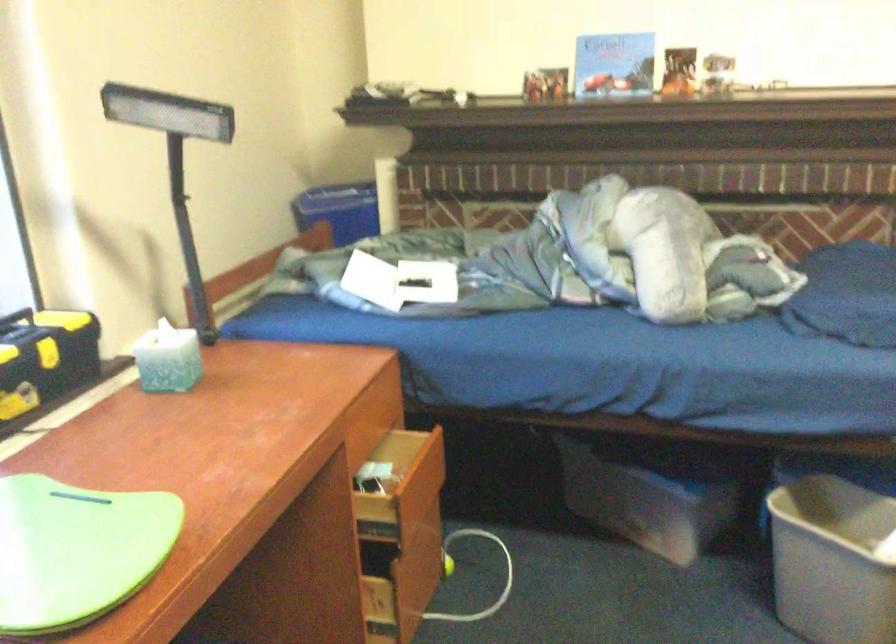
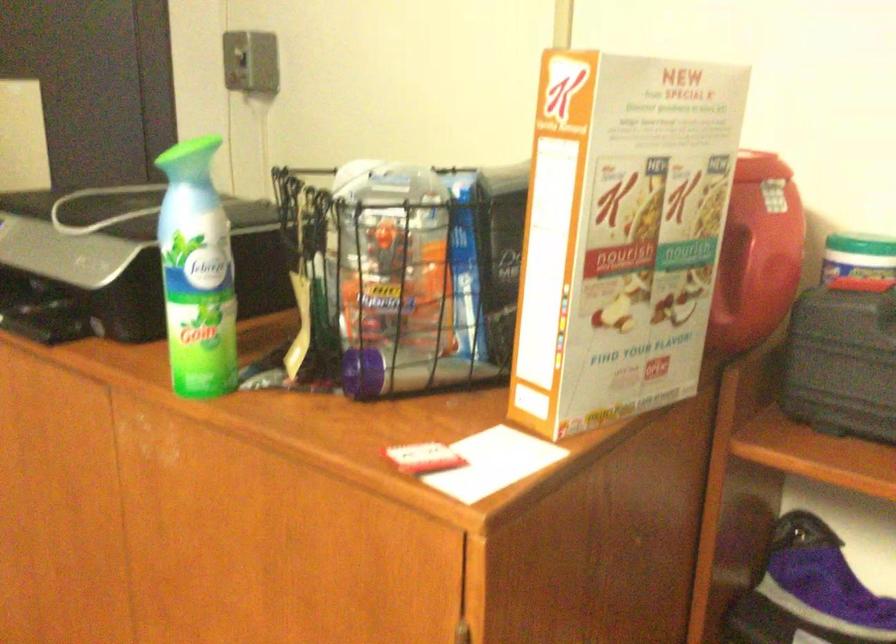
The images are taken continuously from a first-person perspective. In which direction is your viewpoint rotating?

The camera's rotation is toward right-down.